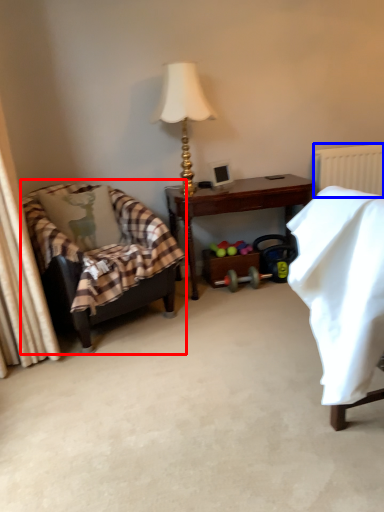
Question: Which object appears closest to the camera in this image, chair (highlighted by a red box) or radiator (highlighted by a blue box)?

Choices:
 (A) chair
 (B) radiator

Answer: (A)